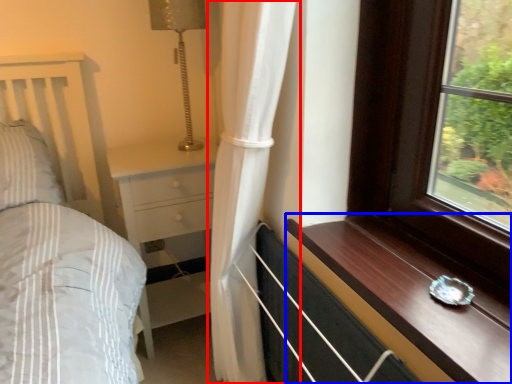
Question: Which object is closer to the camera taking this photo, curtain (highlighted by a red box) or window sill (highlighted by a blue box)?

Choices:
 (A) curtain
 (B) window sill

Answer: (B)